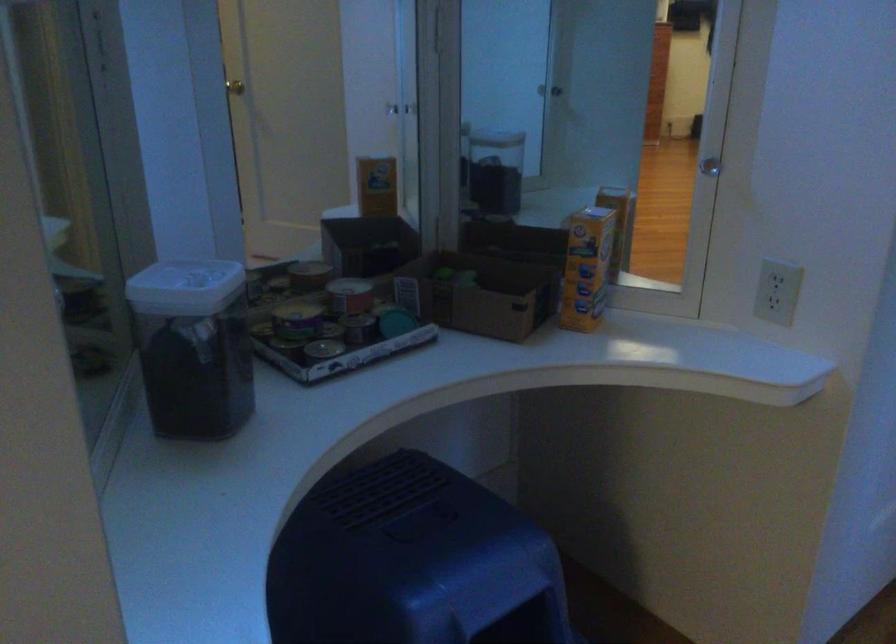
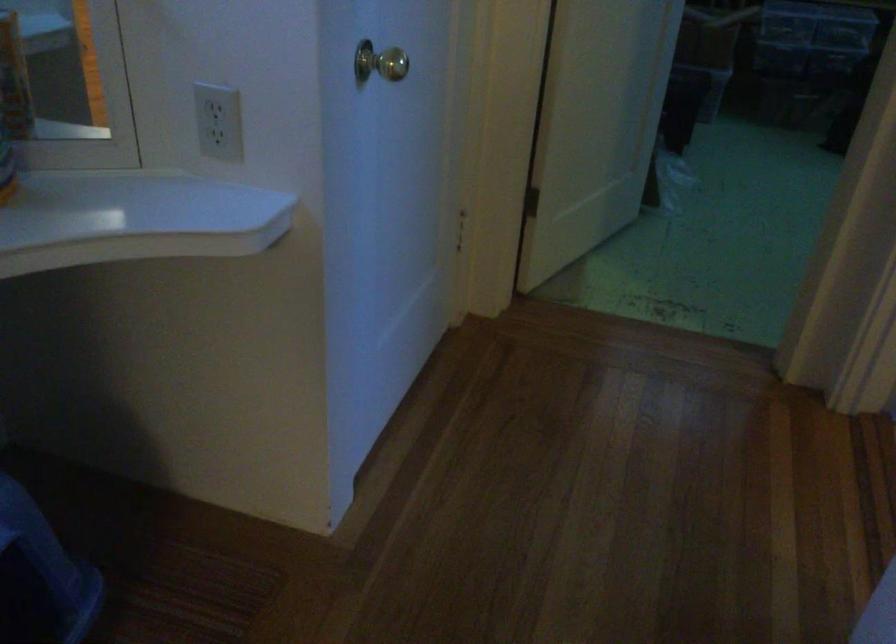
Question: The camera is either moving clockwise (left) or counter-clockwise (right) around the object. The first image is from the beginning of the video and the second image is from the end. Is the camera moving left or right when shooting the video?

Choices:
 (A) Left
 (B) Right

Answer: (A)